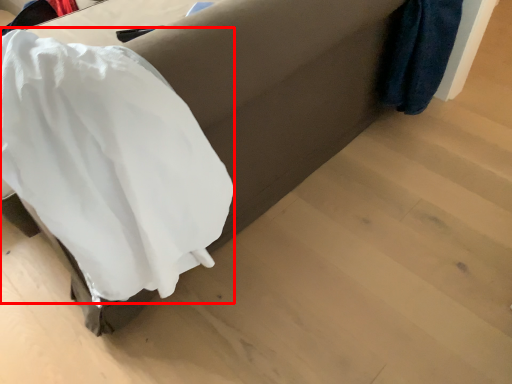
Question: Considering the relative positions of clothing (annotated by the red box) and furniture in the image provided, where is clothing (annotated by the red box) located with respect to the staircase?

Choices:
 (A) left
 (B) right

Answer: (A)